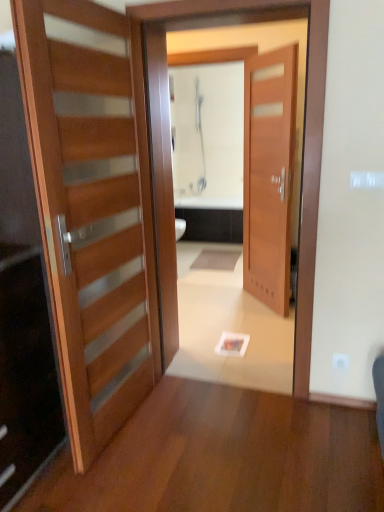
This screenshot has height=512, width=384. What are the coordinates of `unoccupied space behind wooden door at center` in the screenshot? It's located at (236, 332).